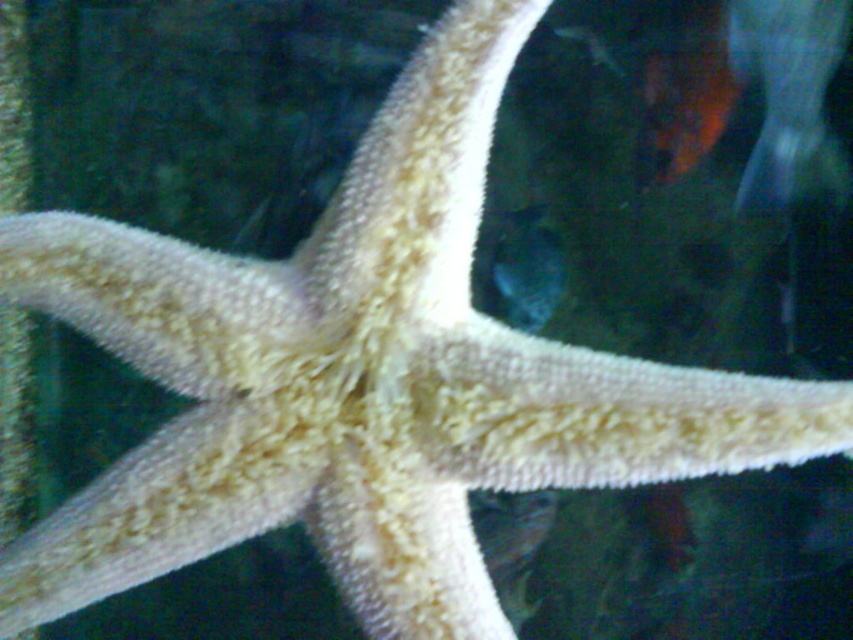
Question: Can you confirm if orange matte goldfish at upper right is wider than shiny silver fish at upper center?

Choices:
 (A) yes
 (B) no

Answer: (A)

Question: Is orange matte goldfish at upper right wider than shiny silver fish at upper center?

Choices:
 (A) no
 (B) yes

Answer: (B)

Question: Among these points, which one is farthest from the camera?

Choices:
 (A) (706, 48)
 (B) (602, 42)

Answer: (B)

Question: Among these points, which one is farthest from the camera?

Choices:
 (A) (573, 36)
 (B) (700, 124)

Answer: (A)

Question: Can you confirm if orange matte goldfish at upper right is thinner than shiny silver fish at upper center?

Choices:
 (A) yes
 (B) no

Answer: (B)